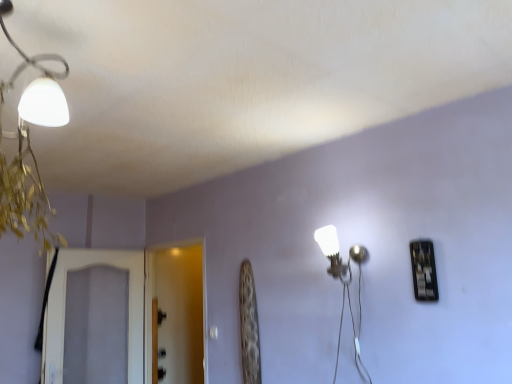
Question: Can you confirm if white glossy wall lamp at center-right is shorter than transparent glass screen door at center, the first screen door in the right-to-left sequence?

Choices:
 (A) no
 (B) yes

Answer: (B)

Question: Is transparent glass screen door at center, the 2th screen door from the left, located within white glossy wall lamp at center-right?

Choices:
 (A) yes
 (B) no

Answer: (B)

Question: Does white glossy wall lamp at center-right have a smaller size compared to transparent glass screen door at center, the 2th screen door from the left?

Choices:
 (A) no
 (B) yes

Answer: (B)

Question: Are white glossy wall lamp at center-right and transparent glass screen door at center, the first screen door in the right-to-left sequence, beside each other?

Choices:
 (A) yes
 (B) no

Answer: (B)

Question: Are white glossy wall lamp at center-right and transparent glass screen door at center, the 2th screen door from the left, far apart?

Choices:
 (A) no
 (B) yes

Answer: (B)

Question: From a real-world perspective, is white glossy wall lamp at center-right under transparent glass screen door at center, the 2th screen door from the left?

Choices:
 (A) yes
 (B) no

Answer: (B)

Question: From a real-world perspective, is white textured screen door at left, the 1th screen door viewed from the left, positioned under white glossy wall lamp at center-right based on gravity?

Choices:
 (A) yes
 (B) no

Answer: (A)

Question: From the image's perspective, is white textured screen door at left, acting as the 2th screen door starting from the right, on white glossy wall lamp at center-right?

Choices:
 (A) no
 (B) yes

Answer: (A)

Question: Is white glossy wall lamp at center-right a part of white textured screen door at left, the 1th screen door viewed from the left?

Choices:
 (A) yes
 (B) no

Answer: (B)

Question: Is white textured screen door at left, the 1th screen door viewed from the left, aimed at white glossy wall lamp at center-right?

Choices:
 (A) yes
 (B) no

Answer: (A)

Question: Does white textured screen door at left, the 1th screen door viewed from the left, have a larger size compared to white glossy wall lamp at center-right?

Choices:
 (A) no
 (B) yes

Answer: (B)

Question: Is white textured screen door at left, the 1th screen door viewed from the left, thinner than white glossy wall lamp at center-right?

Choices:
 (A) no
 (B) yes

Answer: (B)

Question: Does white textured screen door at left, acting as the 2th screen door starting from the right, turn towards transparent glass screen door at center, the first screen door in the right-to-left sequence?

Choices:
 (A) no
 (B) yes

Answer: (B)